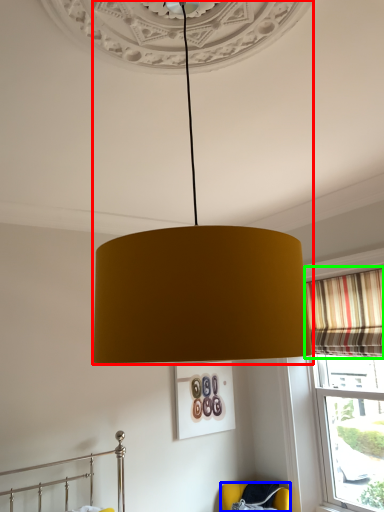
Question: Based on their relative distances, which object is nearer to lamp (highlighted by a red box)? Choose from furniture (highlighted by a blue box) and curtain (highlighted by a green box).

Choices:
 (A) furniture
 (B) curtain

Answer: (B)